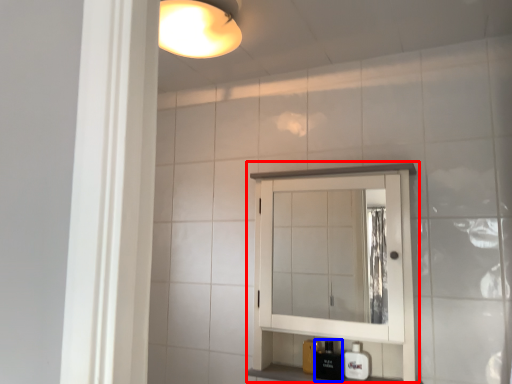
Question: Which point is closer to the camera, medicine cabinet (highlighted by a red box) or toiletry (highlighted by a blue box)?

Choices:
 (A) medicine cabinet
 (B) toiletry

Answer: (A)